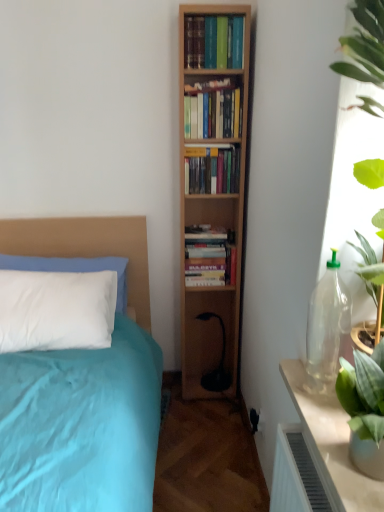
What is the approximate width of wooden bookshelf at center, which is the 3th book from bottom to top?

5.05 inches.

The width and height of the screenshot is (384, 512). I want to click on translucent glass table at right, so click(x=331, y=442).

Where is `wooden bookshelf at center, which is the 3th book from bottom to top`? wooden bookshelf at center, which is the 3th book from bottom to top is located at coordinates (212, 110).

Looking at this image, which object is further away from the camera taking this photo, wooden bookshelf at center, which appears as the 3th book when viewed from the top, or beige fabric headboard at left?

wooden bookshelf at center, which appears as the 3th book when viewed from the top, is further away from the camera.

Between wooden bookshelf at center, the second book from the bottom, and beige fabric headboard at left, which one appears on the left side from the viewer's perspective?

Positioned to the left is beige fabric headboard at left.

Which object is positioned more to the left, beige fabric headboard at left or wooden bookshelf at center, which appears as the 3th book when viewed from the top?

Positioned to the left is beige fabric headboard at left.

How different are the orientations of beige fabric headboard at left and wooden bookshelf at center, the second book from the bottom, in degrees?

They differ by 7.12 degrees in their facing directions.

Considering the sizes of objects beige fabric headboard at left and wooden bookshelf at center, the second book from the bottom, in the image provided, who is shorter, beige fabric headboard at left or wooden bookshelf at center, the second book from the bottom,?

With less height is wooden bookshelf at center, the second book from the bottom.

Between translucent glass table at right and wooden bookshelf at center, the second book from the bottom, which one has smaller size?

With smaller size is wooden bookshelf at center, the second book from the bottom.

Where is `table on the right of wooden bookshelf at center, the second book from the bottom`? table on the right of wooden bookshelf at center, the second book from the bottom is located at coordinates (331, 442).

Consider the image. Is translucent glass table at right oriented towards wooden bookshelf at center, the second book from the bottom?

No, translucent glass table at right is not facing towards wooden bookshelf at center, the second book from the bottom.

Does point (220, 23) come behind point (351, 487)?

Yes.

Measure the distance between hardcover books at center, positioned as the 1th book in top-to-bottom order, and translucent glass table at right.

A distance of 1.42 meters exists between hardcover books at center, positioned as the 1th book in top-to-bottom order, and translucent glass table at right.

Can you tell me how much hardcover books at center, positioned as the fourth book in bottom-to-top order, and translucent glass table at right differ in facing direction?

90 degrees.

Is hardcover books at center, positioned as the fourth book in bottom-to-top order, inside the boundaries of translucent glass table at right, or outside?

The correct answer is: outside.

Considering the positions of point (217, 49) and point (196, 178), is point (217, 49) closer or farther from the camera than point (196, 178)?

Point (217, 49).

From a real-world perspective, which object rests below the other?

wooden bookshelf at center, the second book from the bottom, from a real-world perspective.

How many degrees apart are the facing directions of hardcover books at center, positioned as the 1th book in top-to-bottom order, and wooden bookshelf at center, the second book from the bottom?

The angle between the facing direction of hardcover books at center, positioned as the 1th book in top-to-bottom order, and the facing direction of wooden bookshelf at center, the second book from the bottom, is 2.7 degrees.

How distant is hardcover books at center, positioned as the fourth book in bottom-to-top order, from wooden bookshelf at center, which appears as the 3th book when viewed from the top?

44.61 centimeters.

Considering the sizes of objects hardcover books at center, which is the 1th book from bottom to top, and wooden bookshelf at center, the second book from the bottom, in the image provided, who is smaller, hardcover books at center, which is the 1th book from bottom to top, or wooden bookshelf at center, the second book from the bottom,?

With smaller size is wooden bookshelf at center, the second book from the bottom.

From the image's perspective, who appears lower, hardcover books at center, which ranks as the fourth book in top-to-bottom order, or wooden bookshelf at center, which appears as the 3th book when viewed from the top?

From the image's view, hardcover books at center, which ranks as the fourth book in top-to-bottom order, is below.

What's the angular difference between hardcover books at center, which ranks as the fourth book in top-to-bottom order, and wooden bookshelf at center, which appears as the 3th book when viewed from the top,'s facing directions?

There is a 3.6-degree angle between the facing directions of hardcover books at center, which ranks as the fourth book in top-to-bottom order, and wooden bookshelf at center, which appears as the 3th book when viewed from the top.

Based on the photo, which of these two, hardcover books at center, which ranks as the fourth book in top-to-bottom order, or wooden bookshelf at center, which appears as the 3th book when viewed from the top, is thinner?

Thinner between the two is wooden bookshelf at center, which appears as the 3th book when viewed from the top.

From a real-world perspective, is hardcover books at center, positioned as the fourth book in bottom-to-top order, below beige fabric headboard at left?

No.

Does hardcover books at center, positioned as the 1th book in top-to-bottom order, have a smaller size compared to beige fabric headboard at left?

Yes, hardcover books at center, positioned as the 1th book in top-to-bottom order, is smaller than beige fabric headboard at left.

Is hardcover books at center, positioned as the fourth book in bottom-to-top order, oriented towards beige fabric headboard at left?

No, hardcover books at center, positioned as the fourth book in bottom-to-top order, is not turned towards beige fabric headboard at left.

Image resolution: width=384 pixels, height=512 pixels. In the image, there is a wooden bookshelf at center, the second book from the bottom. What are the coordinates of `headboard below it (from a real-world perspective)` in the screenshot? It's located at (88, 248).

Where is `headboard that is below the wooden bookshelf at center, which appears as the 3th book when viewed from the top (from the image's perspective)`? This screenshot has height=512, width=384. headboard that is below the wooden bookshelf at center, which appears as the 3th book when viewed from the top (from the image's perspective) is located at coordinates (88, 248).

Which object lies nearer to the anchor point wooden bookshelf at center, which is the 3th book from bottom to top, beige fabric headboard at left or hardcover books at center, which is the 1th book from bottom to top?

Based on the image, hardcover books at center, which is the 1th book from bottom to top, appears to be nearer to wooden bookshelf at center, which is the 3th book from bottom to top.

Estimate the real-world distances between objects in this image. Which object is closer to translucent glass table at right, hardcover books at center, positioned as the fourth book in bottom-to-top order, or wooden bookshelf at center, the second book from the bottom?

Among the two, wooden bookshelf at center, the second book from the bottom, is located nearer to translucent glass table at right.

From the picture: Estimate the real-world distances between objects in this image. Which object is closer to beige fabric headboard at left, translucent glass table at right or hardcover books at center, positioned as the fourth book in bottom-to-top order?

hardcover books at center, positioned as the fourth book in bottom-to-top order.

Looking at the image, which one is located further to translucent glass table at right, beige fabric headboard at left or hardcover books at center, positioned as the fourth book in bottom-to-top order?

hardcover books at center, positioned as the fourth book in bottom-to-top order, is positioned further to the anchor translucent glass table at right.

Looking at this image, from the image, which object appears to be nearer to hardcover books at center, positioned as the fourth book in bottom-to-top order, beige fabric headboard at left or wooden bookshelf at center, which is the 3th book from bottom to top?

wooden bookshelf at center, which is the 3th book from bottom to top, is positioned closer to the anchor hardcover books at center, positioned as the fourth book in bottom-to-top order.

Which object lies nearer to the anchor point hardcover books at center, which ranks as the fourth book in top-to-bottom order, translucent glass table at right or wooden bookshelf at center, the second book from the bottom?

Based on the image, wooden bookshelf at center, the second book from the bottom, appears to be nearer to hardcover books at center, which ranks as the fourth book in top-to-bottom order.

Based on their spatial positions, is hardcover books at center, which ranks as the fourth book in top-to-bottom order, or hardcover books at center, positioned as the 1th book in top-to-bottom order, further from beige fabric headboard at left?

hardcover books at center, positioned as the 1th book in top-to-bottom order, lies further to beige fabric headboard at left than the other object.

Based on the photo, considering their positions, is wooden bookshelf at center, which is the 3th book from bottom to top, positioned closer to beige fabric headboard at left than hardcover books at center, positioned as the fourth book in bottom-to-top order?

wooden bookshelf at center, which is the 3th book from bottom to top.

Locate an element on the screen. The width and height of the screenshot is (384, 512). book situated between beige fabric headboard at left and wooden bookshelf at center, which appears as the second book when viewed from the top, from left to right is located at coordinates (209, 257).

The image size is (384, 512). I want to click on book positioned between translucent glass table at right and wooden bookshelf at center, which is the 3th book from bottom to top, from near to far, so click(213, 42).

Find the location of a particular element. headboard located between translucent glass table at right and hardcover books at center, which ranks as the fourth book in top-to-bottom order, in the depth direction is located at coordinates [88, 248].

Locate an element on the screen. book between hardcover books at center, positioned as the 1th book in top-to-bottom order, and wooden bookshelf at center, which appears as the 3th book when viewed from the top, vertically is located at coordinates (212, 110).